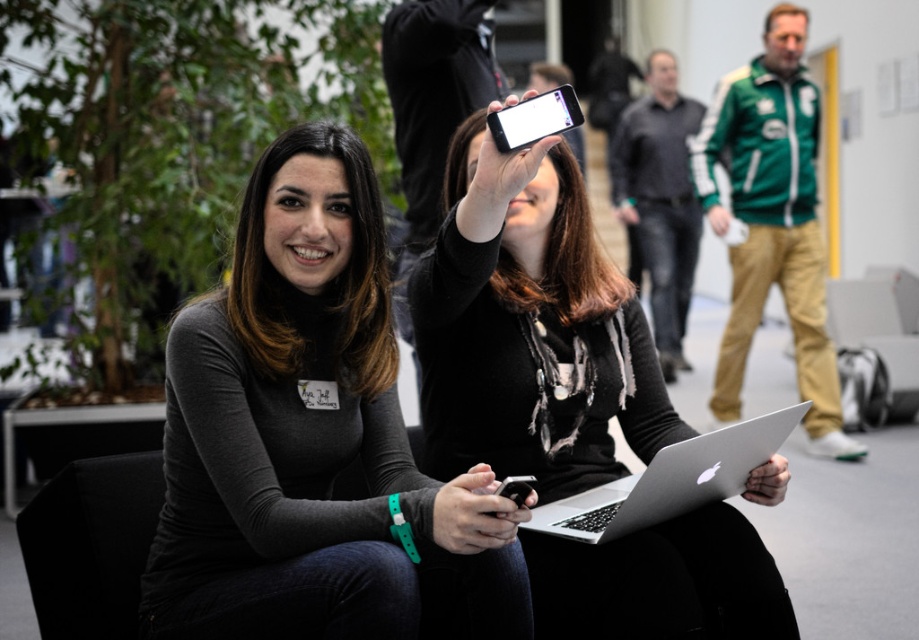
Question: Is matte black scarf at center in front of white glossy phone at upper center?

Choices:
 (A) yes
 (B) no

Answer: (B)

Question: Estimate the real-world distances between objects in this image. Which object is closer to the light skin flesh at center?

Choices:
 (A) silver metallic laptop at center
 (B) matte black phone at center
 (C) matte black scarf at center

Answer: (A)

Question: Which point is farther from the camera taking this photo?

Choices:
 (A) (770, 115)
 (B) (479, 508)
 (C) (537, 497)

Answer: (A)

Question: Is green fabric jacket at upper right closer to camera compared to light skin flesh at center?

Choices:
 (A) yes
 (B) no

Answer: (B)

Question: Considering the relative positions of matte black sweater at center and white glossy phone at upper center in the image provided, where is matte black sweater at center located with respect to white glossy phone at upper center?

Choices:
 (A) right
 (B) left

Answer: (B)

Question: Which of the following is the farthest from the observer?

Choices:
 (A) matte black phone at center
 (B) white glossy phone at upper center

Answer: (A)